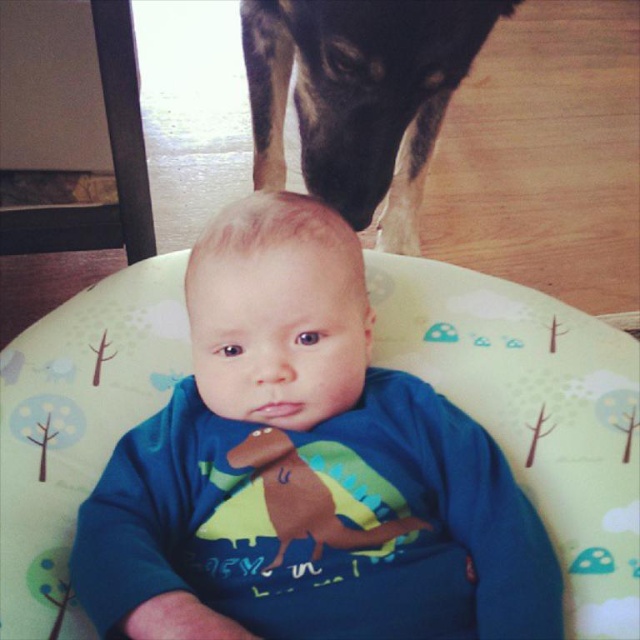
Is point (337, 216) farther from camera compared to point (477, 8)?

That is False.

The image size is (640, 640). What do you see at coordinates (305, 472) in the screenshot? I see `blue soft baby at center` at bounding box center [305, 472].

At what (x,y) coordinates should I click in order to perform the action: click on blue soft baby at center. Please return your answer as a coordinate pair (x, y). This screenshot has height=640, width=640. Looking at the image, I should click on (305, 472).